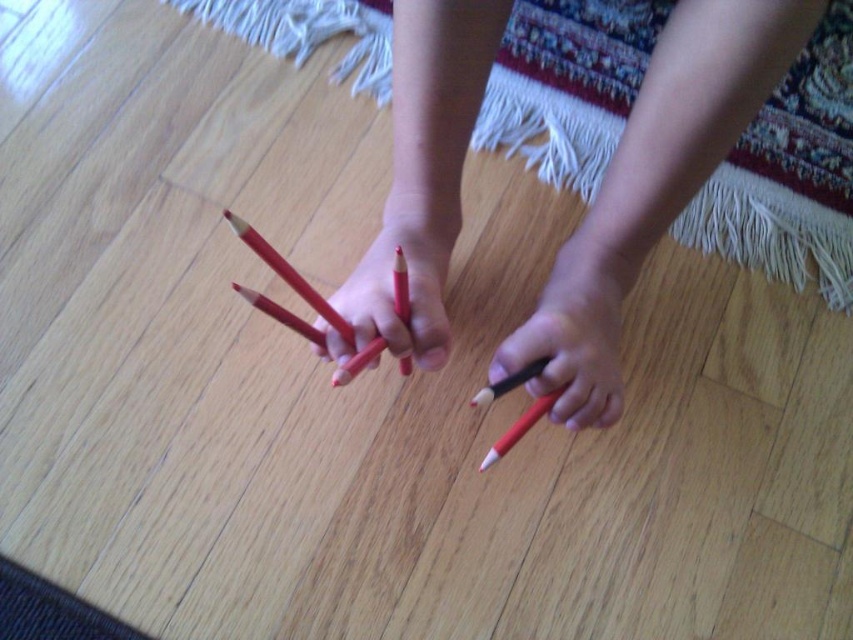
I want to click on matte black pencil at lower center, so click(572, 352).

How distant is matte black pencil at lower center from matte red pencil at center?

14.04 centimeters

At what (x,y) coordinates should I click in order to perform the action: click on matte black pencil at lower center. Please return your answer as a coordinate pair (x, y). The width and height of the screenshot is (853, 640). Looking at the image, I should click on (572, 352).

Who is lower down, matte wood pencil at center or matte black pencil at lower center?

matte black pencil at lower center

Looking at this image, is matte wood pencil at center closer to camera compared to matte black pencil at lower center?

Yes, matte wood pencil at center is in front of matte black pencil at lower center.

Where is `matte wood pencil at center`? matte wood pencil at center is located at coordinates (651, 188).

This screenshot has height=640, width=853. What are the coordinates of `matte wood pencil at center` in the screenshot? It's located at (651, 188).

What do you see at coordinates (651, 188) in the screenshot? The width and height of the screenshot is (853, 640). I see `matte wood pencil at center` at bounding box center [651, 188].

Does point (468, 70) come behind point (422, 244)?

No, (468, 70) is in front of (422, 244).

What do you see at coordinates (651, 188) in the screenshot? I see `matte wood pencil at center` at bounding box center [651, 188].

Where is `matte wood pencil at center`? matte wood pencil at center is located at coordinates (651, 188).